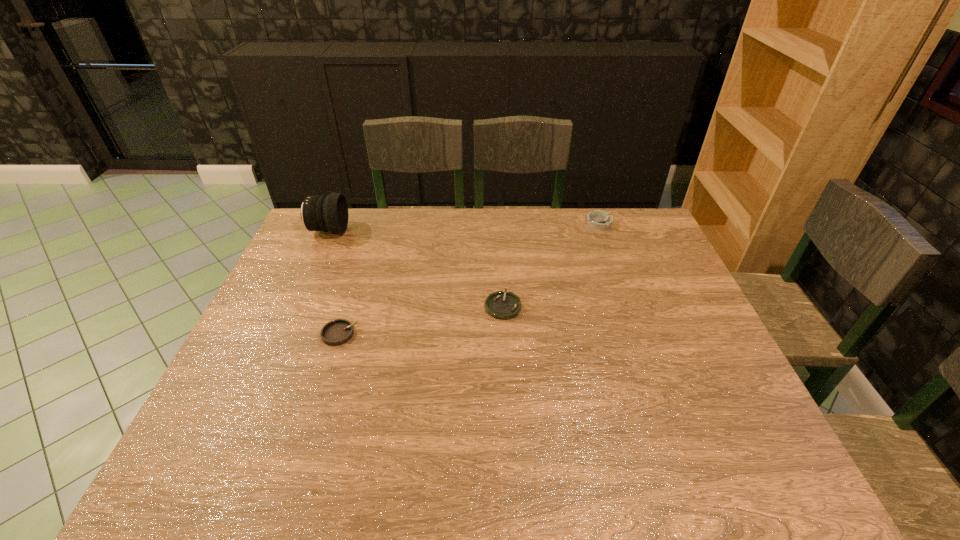
This screenshot has width=960, height=540. Find the location of `telephoto lens`. telephoto lens is located at coordinates (329, 213).

Where is `the tallest object`? The height and width of the screenshot is (540, 960). the tallest object is located at coordinates (329, 213).

In order to click on the rightmost ashtray in this screenshot , I will do [x=600, y=220].

Find the location of `the farthest ashtray`. the farthest ashtray is located at coordinates (600, 220).

Find the location of a particular element. The height and width of the screenshot is (540, 960). the nearest ashtray is located at coordinates (337, 332).

In order to click on the leftmost ashtray in this screenshot , I will do `click(337, 332)`.

Image resolution: width=960 pixels, height=540 pixels. I want to click on the second nearest object, so click(501, 305).

You are a GUI agent. You are given a task and a screenshot of the screen. Output one action in this format:
    pyautogui.click(x=<x>, y=<y>)
    Task: Click on the third object from left to right
    
    Given the screenshot: What is the action you would take?
    click(501, 305)

Find the location of a particular element. The image size is (960, 540). free space located 0.140m at the front element of the telephoto lens is located at coordinates (387, 231).

Locate an element on the screen. This screenshot has height=540, width=960. vacant point located on the right of the tallest ashtray is located at coordinates (633, 223).